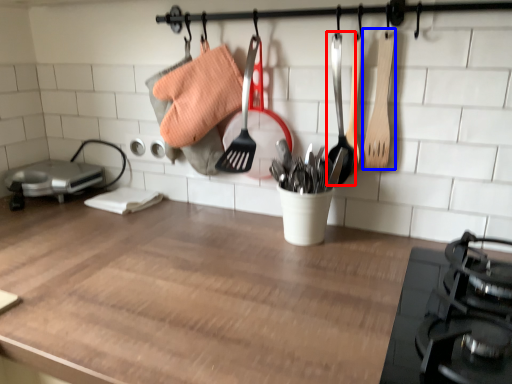
Question: Among these objects, which one is farthest to the camera, utensil (highlighted by a red box) or spatula (highlighted by a blue box)?

Choices:
 (A) utensil
 (B) spatula

Answer: (A)